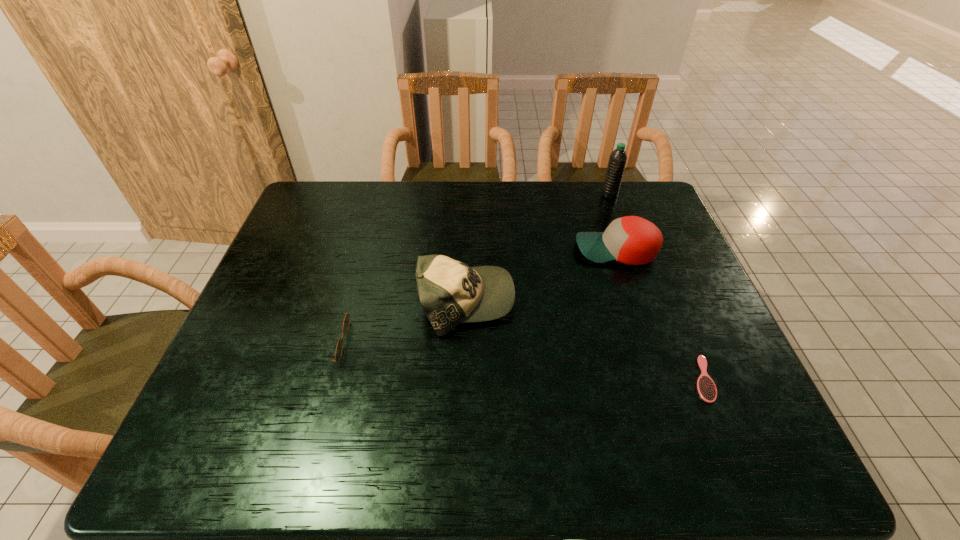
Find the location of a particular element. vacant area situated 0.330m on the front-facing side of the left baseball cap is located at coordinates (641, 301).

Find the location of a particular element. Image resolution: width=960 pixels, height=540 pixels. vacant space located 0.190m at the brim of the farther baseball cap is located at coordinates (510, 250).

Find the location of a particular element. The width and height of the screenshot is (960, 540). free space located 0.150m at the brim of the farther baseball cap is located at coordinates (523, 250).

Locate an element on the screen. blank space located 0.220m at the brim of the farther baseball cap is located at coordinates (499, 250).

Locate an element on the screen. vacant space located on the face of the leftmost object is located at coordinates (495, 342).

Where is `vacant space located 0.060m on the front of the shortest object`? vacant space located 0.060m on the front of the shortest object is located at coordinates (724, 430).

Where is `object that is at the far edge`? Image resolution: width=960 pixels, height=540 pixels. object that is at the far edge is located at coordinates (617, 161).

Find the location of a particular element. water bottle positioned at the right edge is located at coordinates (617, 161).

Identify the location of baseball cap located at the right edge. (633, 240).

Image resolution: width=960 pixels, height=540 pixels. Identify the location of hairbrush situated at the right edge. [x=707, y=390].